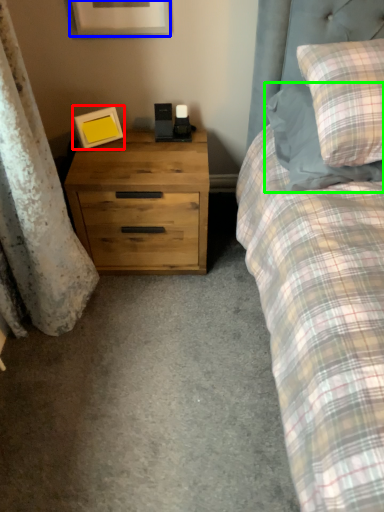
Question: Which object is the farthest from picture frame (highlighted by a red box)? Choose among these: picture frame (highlighted by a blue box) or pillow (highlighted by a green box).

Choices:
 (A) picture frame
 (B) pillow

Answer: (B)